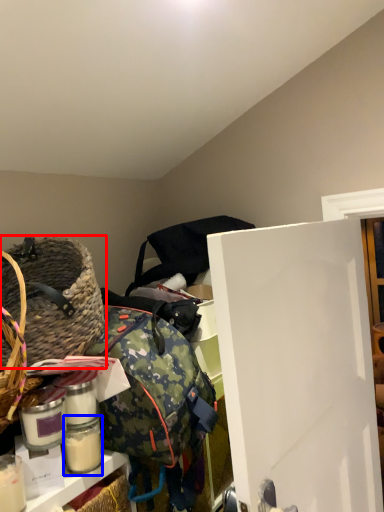
Question: Which object appears closest to the camera in this image, picnic basket (highlighted by a red box) or glass jar (highlighted by a blue box)?

Choices:
 (A) picnic basket
 (B) glass jar

Answer: (A)